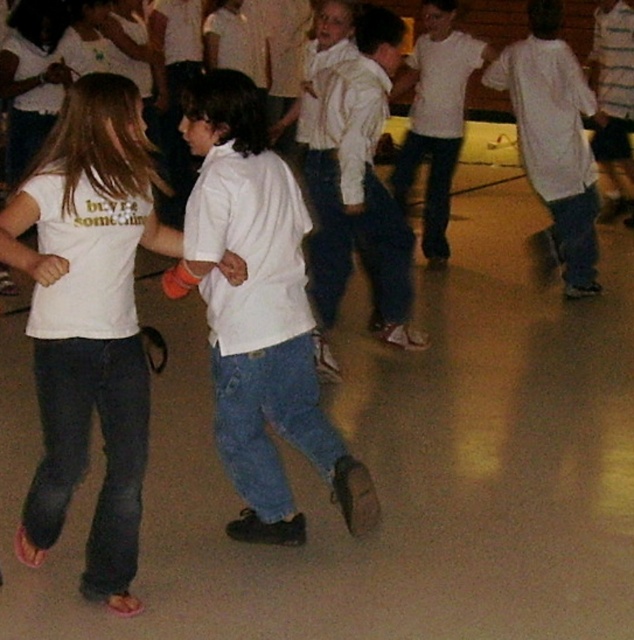
You are a photographer trying to capture a clear shot of both the white matte shirt at center and the white cotton shirt at center. Since both are at the same position, which one do you think will be easier to see in the photo?

The white matte shirt at center is shorter than the white cotton shirt at center, so the white matte shirt at center will be easier to see in the photo because it is closer to the camera.